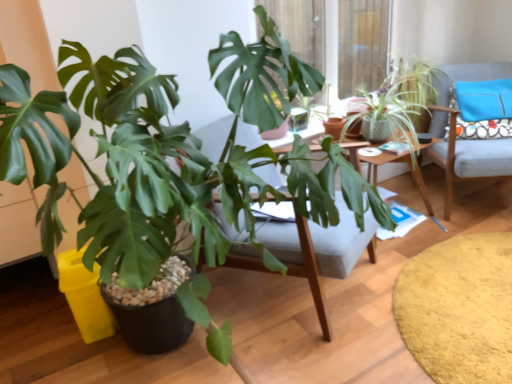
Where is `vacant space situated above soft yellow rug at lower right (from a real-world perspective)`? This screenshot has height=384, width=512. vacant space situated above soft yellow rug at lower right (from a real-world perspective) is located at coordinates click(x=459, y=290).